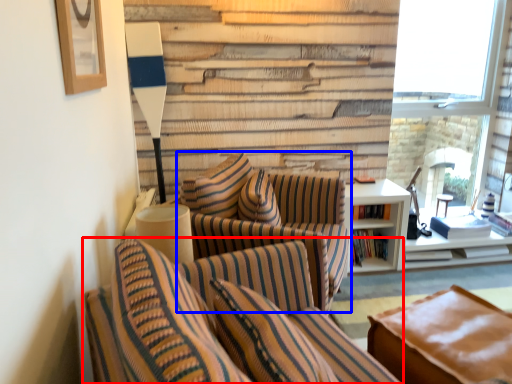
Question: Which object appears farthest to the camera in this image, chair (highlighted by a red box) or chair (highlighted by a blue box)?

Choices:
 (A) chair
 (B) chair

Answer: (B)